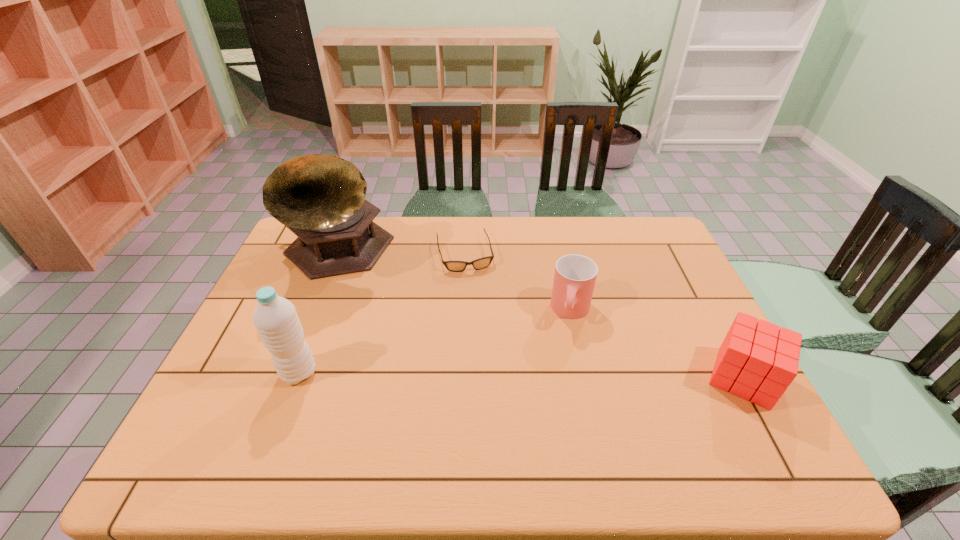
Locate an element on the screen. Image resolution: width=960 pixels, height=540 pixels. free space at the far right corner of the desktop is located at coordinates (615, 217).

Locate an element on the screen. free space between the rightmost object and the tallest object is located at coordinates (540, 316).

Find the location of a particular element. free spot between the sunglasses and the cube is located at coordinates (604, 315).

What are the coordinates of `free space that is in between the phonograph record and the water bottle` in the screenshot? It's located at (318, 314).

Locate an element on the screen. This screenshot has height=540, width=960. vacant area that lies between the cube and the third object from left to right is located at coordinates [604, 315].

Find the location of `free space between the fourth object from left to right and the sunglasses`. free space between the fourth object from left to right and the sunglasses is located at coordinates (517, 282).

Where is `free point between the second tallest object and the rightmost object`? free point between the second tallest object and the rightmost object is located at coordinates (521, 375).

Identify the location of free space that is in between the phonograph record and the fourth object from left to right. pos(454,283).

Locate an element on the screen. This screenshot has width=960, height=540. free space between the cup and the third object from right to left is located at coordinates (517, 282).

Find the location of `vacant area between the shortest object and the phonograph record`. vacant area between the shortest object and the phonograph record is located at coordinates (x=400, y=254).